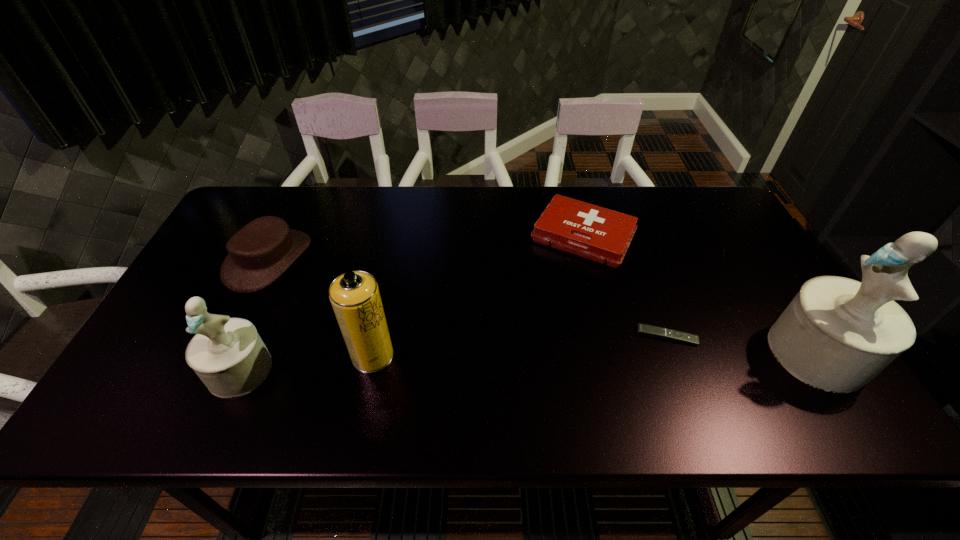
You are a GUI agent. You are given a task and a screenshot of the screen. Output one action in this format:
    pyautogui.click(x=<x>, y=<y>)
    Task: Click on the shorter figurine
    This screenshot has width=960, height=540.
    Given the screenshot: What is the action you would take?
    tap(228, 355)

The height and width of the screenshot is (540, 960). In order to click on the taller figurine in this screenshot , I will do `click(837, 334)`.

This screenshot has height=540, width=960. I want to click on the right figurine, so click(837, 334).

I want to click on the first-aid kit, so click(x=603, y=235).

I want to click on the fourth object from right to left, so click(x=355, y=297).

Locate an element on the screen. the fourth tallest object is located at coordinates (259, 253).

This screenshot has height=540, width=960. Find the location of `remote control`. remote control is located at coordinates (642, 329).

You are a GUI agent. You are given a task and a screenshot of the screen. Output one action in this format:
    pyautogui.click(x=<x>, y=<y>)
    Task: Click on the vacant space located 0.290m at the beak of the rightmost object
    Image resolution: width=960 pixels, height=540 pixels.
    Given the screenshot: What is the action you would take?
    pyautogui.click(x=651, y=353)

The image size is (960, 540). What are the coordinates of `vacant space situated at the beak of the rightmost object` in the screenshot? It's located at (747, 353).

You are a GUI agent. You are given a task and a screenshot of the screen. Output one action in this format:
    pyautogui.click(x=<x>, y=<y>)
    Task: Click on the vacant space located 0.090m at the beak of the rightmost object
    Image resolution: width=960 pixels, height=540 pixels.
    Given the screenshot: What is the action you would take?
    pyautogui.click(x=734, y=353)